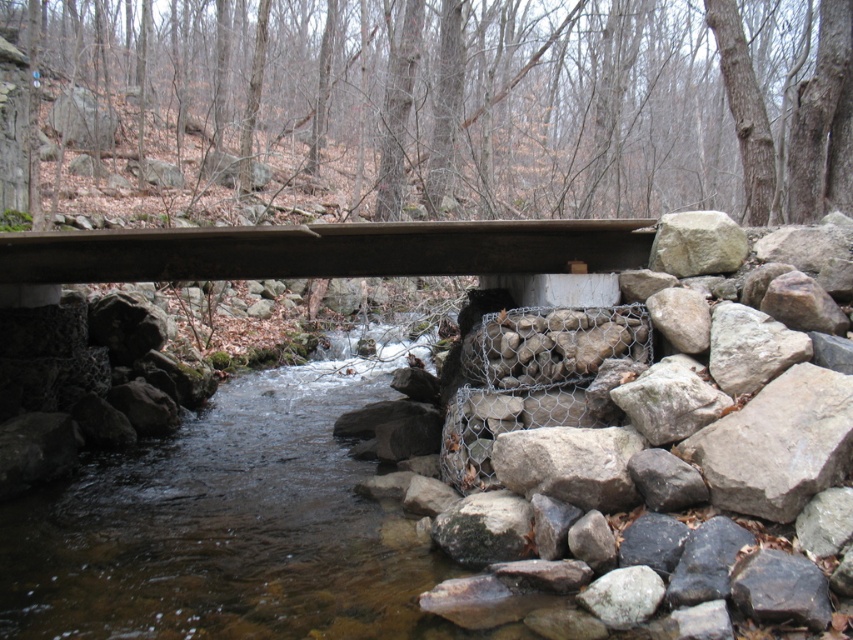
You are a hiker trying to cross the stream. You see the brown wooden bridge at center and the gray rough rock at right. Which object should you approach to safely cross the stream?

You should approach the brown wooden bridge at center to safely cross the stream because it is designed for crossing, while the gray rough rock at right is positioned further to the right and may not provide a stable path.

You are a hiker trying to cross the stream. You see the brown wooden bridge at center and the gray rough rock at right. Which object is closer to the water surface?

The brown wooden bridge at center is located below the gray rough rock at right, so it is closer to the water surface.

You are a hiker carrying a heavy backpack and need to cross the stream. The brown wooden bridge at center and the gray rough rock at right are both potential paths. Which path is more accessible for you to reach first without getting wet?

The brown wooden bridge at center is closer to the viewer than the gray rough rock at right, so you can reach the brown wooden bridge at center first without getting wet.